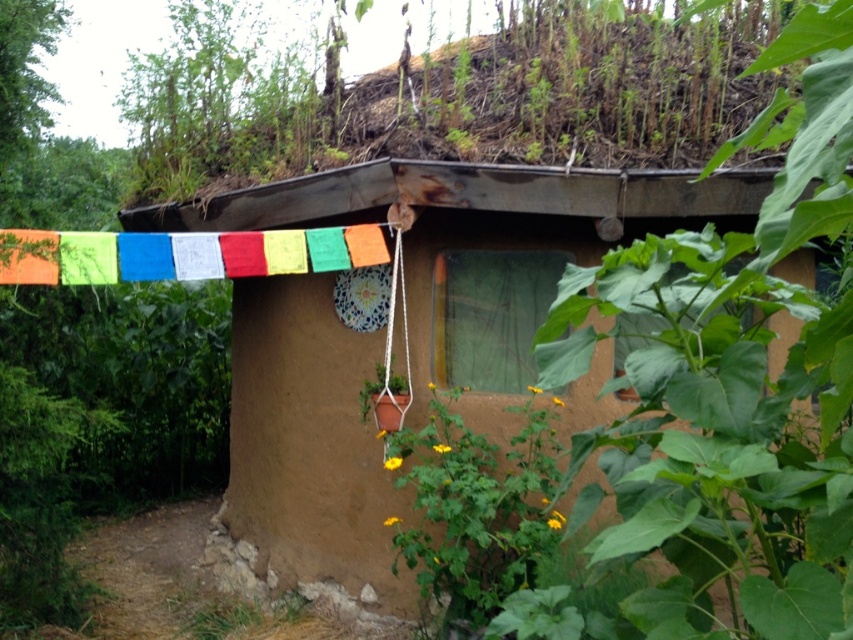
Question: Is brown clay hut at center further to the viewer compared to yellow-green leafy plant at lower center?

Choices:
 (A) no
 (B) yes

Answer: (A)

Question: Can you confirm if brown clay hut at center is positioned to the left of yellow-green leafy plant at lower center?

Choices:
 (A) no
 (B) yes

Answer: (A)

Question: Which object appears farthest from the camera in this image?

Choices:
 (A) yellow-green leafy plant at lower center
 (B) brown clay hut at center

Answer: (A)

Question: Does brown clay hut at center have a smaller size compared to yellow-green leafy plant at lower center?

Choices:
 (A) yes
 (B) no

Answer: (B)